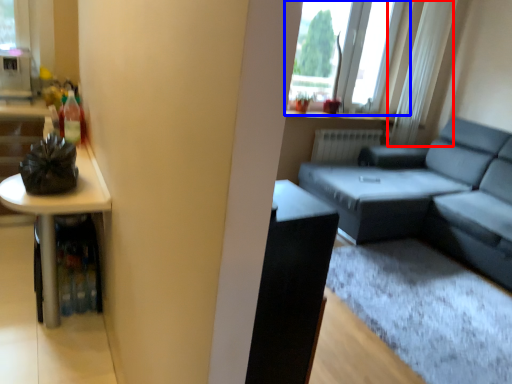
Question: Which object appears closest to the camera in this image, curtain (highlighted by a red box) or window (highlighted by a blue box)?

Choices:
 (A) curtain
 (B) window

Answer: (B)